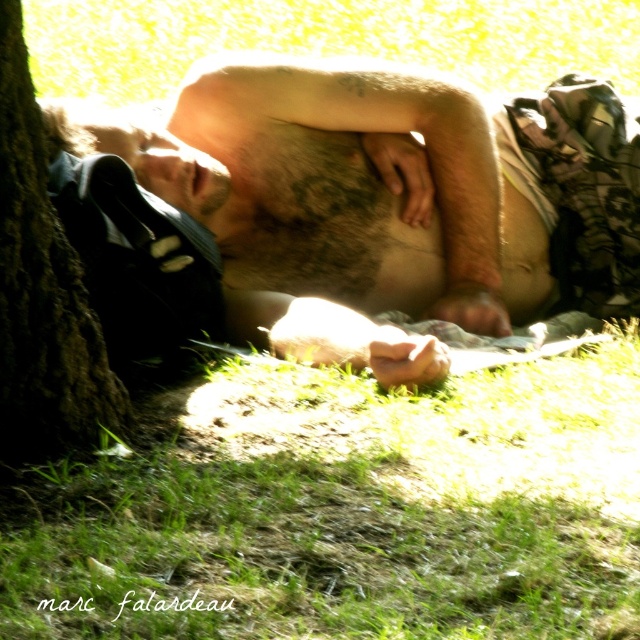
Is hairy skin at center thinner than brown rough bark at left?

No.

The width and height of the screenshot is (640, 640). Find the location of `hairy skin at center`. hairy skin at center is located at coordinates (387, 202).

The image size is (640, 640). In order to click on hairy skin at center in this screenshot , I will do pyautogui.click(x=387, y=202).

Can you confirm if green grass at lower center is thinner than hairy skin at center?

Indeed, green grass at lower center has a lesser width compared to hairy skin at center.

Which is more to the right, green grass at lower center or hairy skin at center?

From the viewer's perspective, green grass at lower center appears more on the right side.

Does point (305, 586) lie in front of point (497, 220)?

That is True.

At what (x,y) coordinates should I click in order to perform the action: click on green grass at lower center. Please return your answer as a coordinate pair (x, y). This screenshot has height=640, width=640. Looking at the image, I should click on (348, 512).

Does green grass at lower center appear under brown rough bark at left?

Yes.

Which of these two, green grass at lower center or brown rough bark at left, stands shorter?

Standing shorter between the two is green grass at lower center.

Does point (630, 429) come closer to viewer compared to point (38, 125)?

That is False.

You are a GUI agent. You are given a task and a screenshot of the screen. Output one action in this format:
    pyautogui.click(x=<x>, y=<y>)
    Task: Click on the green grass at lower center
    This screenshot has width=640, height=640.
    Given the screenshot: What is the action you would take?
    pyautogui.click(x=348, y=512)